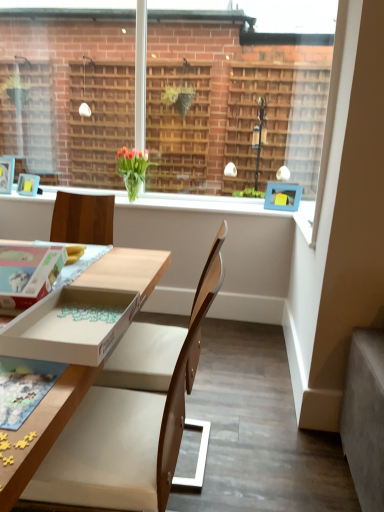
Question: Would you consider wooden chair at center to be distant from white cardboard box at lower left, the first box when ordered from right to left?

Choices:
 (A) yes
 (B) no

Answer: (B)

Question: Is white cardboard box at lower left, arranged as the second box when viewed from the left, at the back of wooden chair at center?

Choices:
 (A) no
 (B) yes

Answer: (B)

Question: From the image's perspective, is wooden chair at center on white cardboard box at lower left, arranged as the second box when viewed from the left?

Choices:
 (A) yes
 (B) no

Answer: (B)

Question: From a real-world perspective, is wooden chair at center positioned under white cardboard box at lower left, arranged as the second box when viewed from the left, based on gravity?

Choices:
 (A) yes
 (B) no

Answer: (A)

Question: Can you confirm if wooden chair at center is smaller than white cardboard box at lower left, the first box when ordered from right to left?

Choices:
 (A) no
 (B) yes

Answer: (A)

Question: Based on their sizes in the image, would you say wooden chair at center is bigger or smaller than brick wall at upper center?

Choices:
 (A) small
 (B) big

Answer: (B)

Question: Is wooden chair at center in front of or behind brick wall at upper center in the image?

Choices:
 (A) behind
 (B) front

Answer: (B)

Question: From a real-world perspective, is wooden chair at center positioned above or below brick wall at upper center?

Choices:
 (A) above
 (B) below

Answer: (B)

Question: From the image's perspective, is wooden chair at center located above or below brick wall at upper center?

Choices:
 (A) below
 (B) above

Answer: (A)

Question: From the image's perspective, is wooden chair at center located above or below cardboard box at lower left, arranged as the 2th box when viewed from the right?

Choices:
 (A) above
 (B) below

Answer: (B)

Question: Is wooden chair at center bigger or smaller than cardboard box at lower left, placed as the 1th box when sorted from left to right?

Choices:
 (A) big
 (B) small

Answer: (A)

Question: From a real-world perspective, is wooden chair at center physically located above or below cardboard box at lower left, placed as the 1th box when sorted from left to right?

Choices:
 (A) below
 (B) above

Answer: (A)

Question: Considering the positions of wooden chair at center and cardboard box at lower left, arranged as the 2th box when viewed from the right, in the image, is wooden chair at center taller or shorter than cardboard box at lower left, arranged as the 2th box when viewed from the right,?

Choices:
 (A) tall
 (B) short

Answer: (A)

Question: In terms of height, does wooden chair at center look taller or shorter compared to white cardboard box at lower left, the first box when ordered from right to left?

Choices:
 (A) tall
 (B) short

Answer: (A)

Question: From the image's perspective, is wooden chair at center positioned above or below white cardboard box at lower left, arranged as the second box when viewed from the left?

Choices:
 (A) above
 (B) below

Answer: (B)